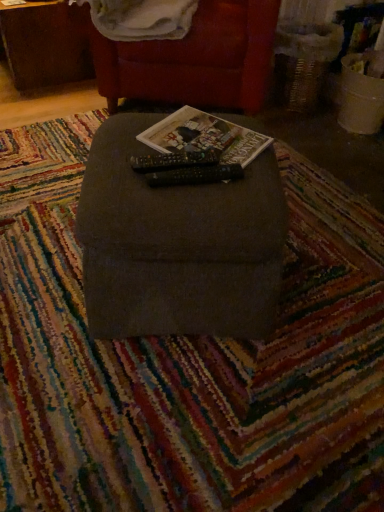
Where is `free space above dark gray fabric ottoman at center, placed as the 2th furniture when sorted from top to bottom (from a real-world perspective)`? This screenshot has width=384, height=512. free space above dark gray fabric ottoman at center, placed as the 2th furniture when sorted from top to bottom (from a real-world perspective) is located at coordinates (184, 148).